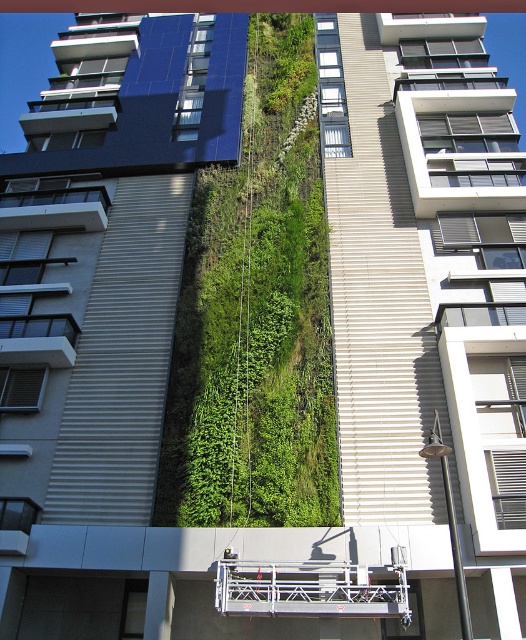
Is point (247, 244) positioned before point (105, 108)?

Yes, it is in front of point (105, 108).

At what (x,y) coordinates should I click in order to perform the action: click on green leafy plant at center. Please return your answer as a coordinate pair (x, y). Image resolution: width=526 pixels, height=640 pixels. Looking at the image, I should click on (257, 314).

What are the coordinates of `green leafy plant at center` in the screenshot? It's located at (257, 314).

The width and height of the screenshot is (526, 640). In order to click on green leafy plant at center in this screenshot , I will do `click(257, 314)`.